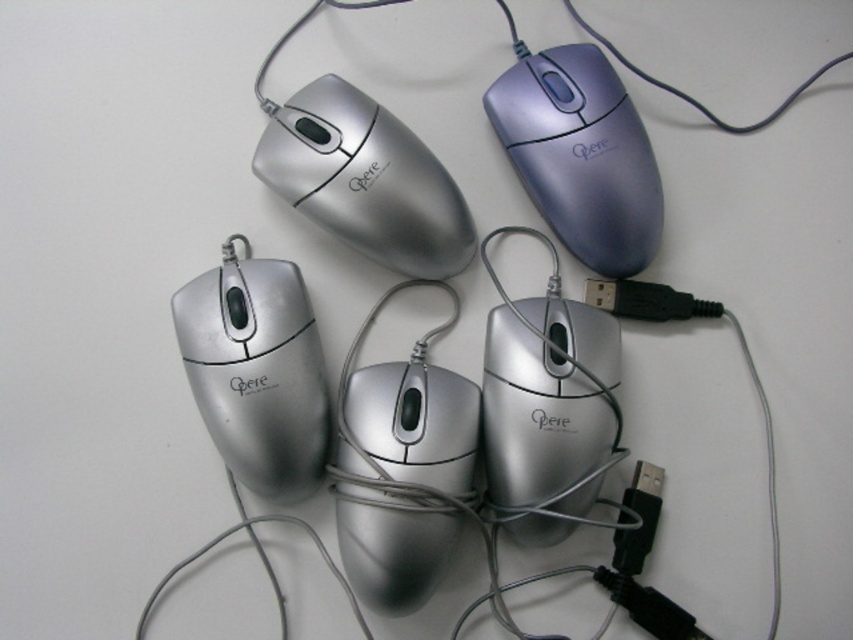
Looking at this image, does metallic blue mouse at upper right come in front of matte silver mouse at upper left?

No, metallic blue mouse at upper right is behind matte silver mouse at upper left.

Can you confirm if metallic blue mouse at upper right is positioned below matte silver mouse at upper left?

Incorrect, metallic blue mouse at upper right is not positioned below matte silver mouse at upper left.

Between point (619, 269) and point (347, 212), which one is positioned in front?

Point (347, 212)

I want to click on metallic blue mouse at upper right, so click(579, 154).

Does point (219, 381) lie in front of point (648, 148)?

That is True.

Where is `silver metallic mouse at center-left`? The image size is (853, 640). silver metallic mouse at center-left is located at coordinates [x=256, y=371].

This screenshot has height=640, width=853. In order to click on silver metallic mouse at center-left in this screenshot , I will do `click(256, 371)`.

Is metallic blue mouse at upper right thinner than black plastic usb plug at center right?

No, metallic blue mouse at upper right is not thinner than black plastic usb plug at center right.

Which is in front, point (566, 49) or point (639, 307)?

Point (566, 49) is in front.

In order to click on metallic blue mouse at upper right in this screenshot , I will do `click(579, 154)`.

The image size is (853, 640). Find the location of `metallic blue mouse at upper right`. metallic blue mouse at upper right is located at coordinates (579, 154).